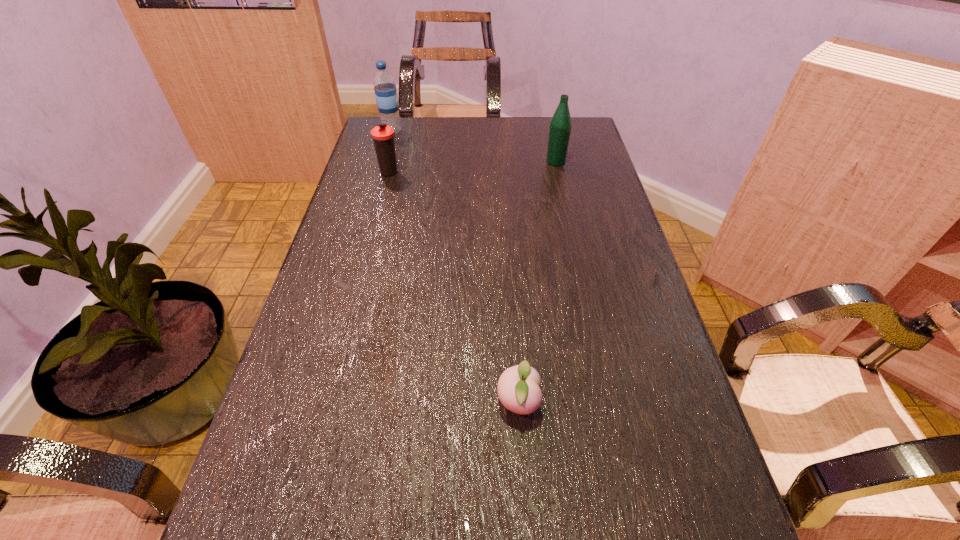
The image size is (960, 540). I want to click on vacant point located between the bottle and the shortest object, so click(537, 282).

Find the location of a particular element. The image size is (960, 540). vacant area that lies between the second shortest object and the peach is located at coordinates (454, 287).

At what (x,y) coordinates should I click in order to perform the action: click on free space between the water bottle and the shortest object. Please return your answer as a coordinate pair (x, y). Looking at the image, I should click on (455, 267).

Where is `vacant space that's between the third tallest object and the rightmost object`? vacant space that's between the third tallest object and the rightmost object is located at coordinates (473, 167).

What are the coordinates of `blank region between the bottle and the thermos bottle` in the screenshot? It's located at (473, 167).

Identify the location of object that stands as the closest to the thermos bottle. (385, 90).

Locate which object is the closest to the water bottle. Please provide its 2D coordinates. Your answer should be formatted as a tuple, i.e. [(x, y)], where the tuple contains the x and y coordinates of a point satisfying the conditions above.

[(383, 135)]

The width and height of the screenshot is (960, 540). Identify the location of free space in the image that satisfies the following two spatial constraints: 1. on the label of the second shortest object; 2. on the left side of the water bottle. (380, 172).

Identify the location of vacant point that satisfies the following two spatial constraints: 1. on the back side of the rightmost object; 2. on the label of the farthest object. The height and width of the screenshot is (540, 960). (549, 132).

Where is `vacant area in the image that satisfies the following two spatial constraints: 1. on the label of the farthest object; 2. on the back side of the third object from left to right`? vacant area in the image that satisfies the following two spatial constraints: 1. on the label of the farthest object; 2. on the back side of the third object from left to right is located at coordinates (316, 403).